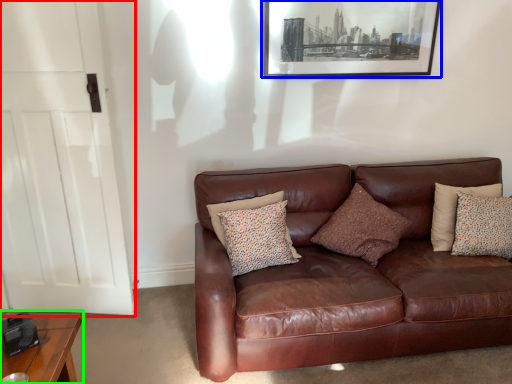
Question: Considering the real-world distances, which object is farthest from door (highlighted by a red box)? picture frame (highlighted by a blue box) or table (highlighted by a green box)?

Choices:
 (A) picture frame
 (B) table

Answer: (A)